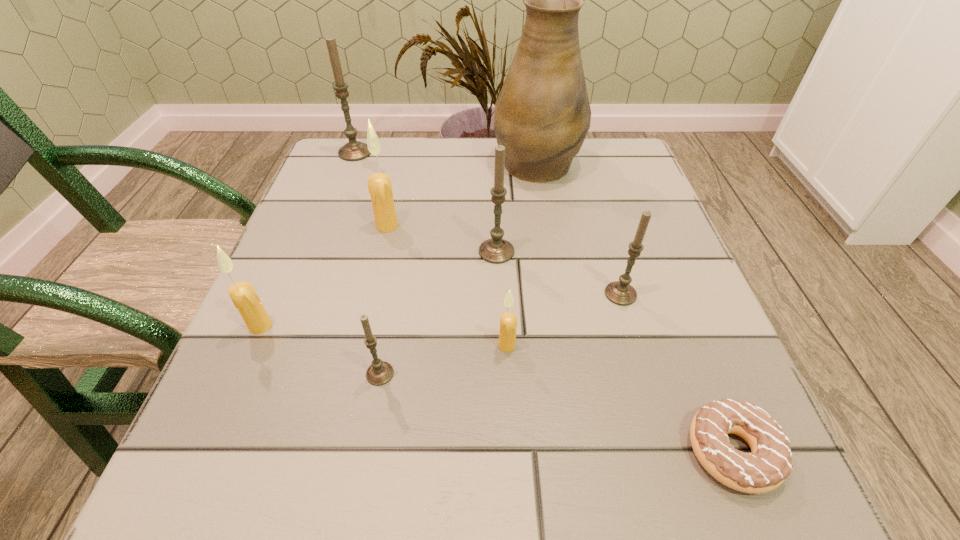
At what (x,y) coordinates should I click in order to perform the action: click on the fourth farthest candle. Please return your answer as a coordinate pair (x, y). This screenshot has width=960, height=540. Looking at the image, I should click on (620, 292).

Where is `the second nearest candle`? The image size is (960, 540). the second nearest candle is located at coordinates (508, 321).

Image resolution: width=960 pixels, height=540 pixels. I want to click on the smallest cream candle, so click(x=508, y=321).

Identify the location of the third gray candle from right to left. (380, 372).

Where is `the eighth farthest object`? The image size is (960, 540). the eighth farthest object is located at coordinates (380, 372).

The width and height of the screenshot is (960, 540). What are the coordinates of `the shortest object` in the screenshot? It's located at (768, 465).

Locate an element on the screen. The width and height of the screenshot is (960, 540). chocolate doughnut is located at coordinates (768, 465).

This screenshot has width=960, height=540. Find the location of `free space located on the right of the biggest gray candle`. free space located on the right of the biggest gray candle is located at coordinates (466, 153).

I want to click on free region located 0.220m on the front of the seventh nearest object, so click(x=366, y=320).

The width and height of the screenshot is (960, 540). What are the coordinates of `vacant area situated 0.380m on the left of the third smallest gray candle` in the screenshot? It's located at [278, 252].